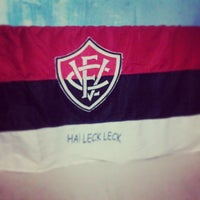
Identify the location of wall. (90, 19).